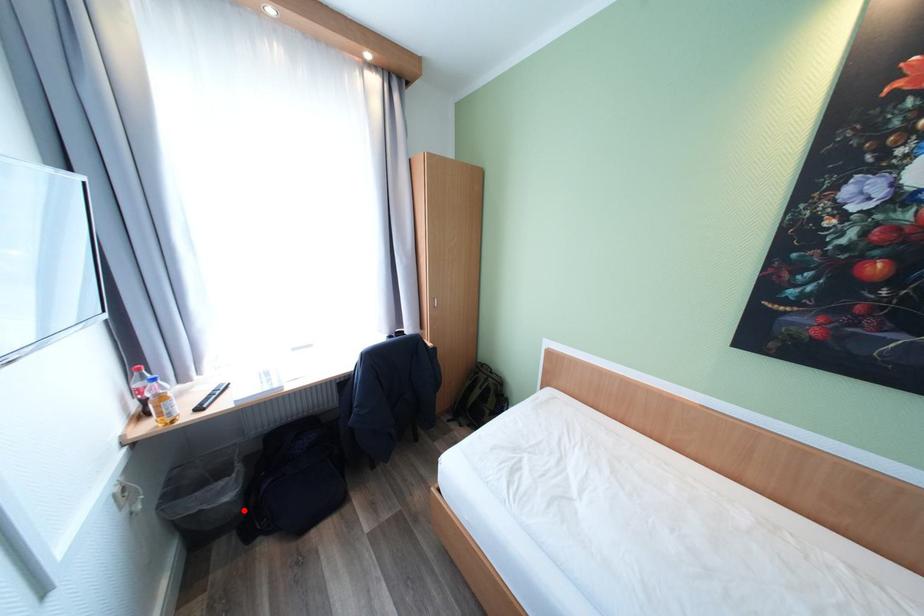
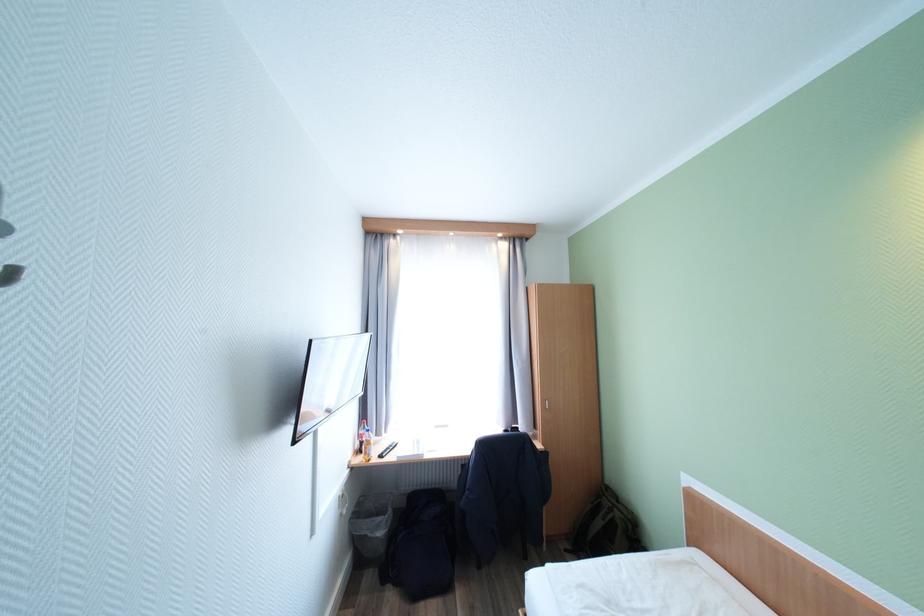
Question: I am providing you with two images of the same scene from different viewpoints. A red point is shown in image1. For the corresponding object point in image2, is it positioned nearer or farther from the camera?

Choices:
 (A) Nearer
 (B) Farther

Answer: (B)